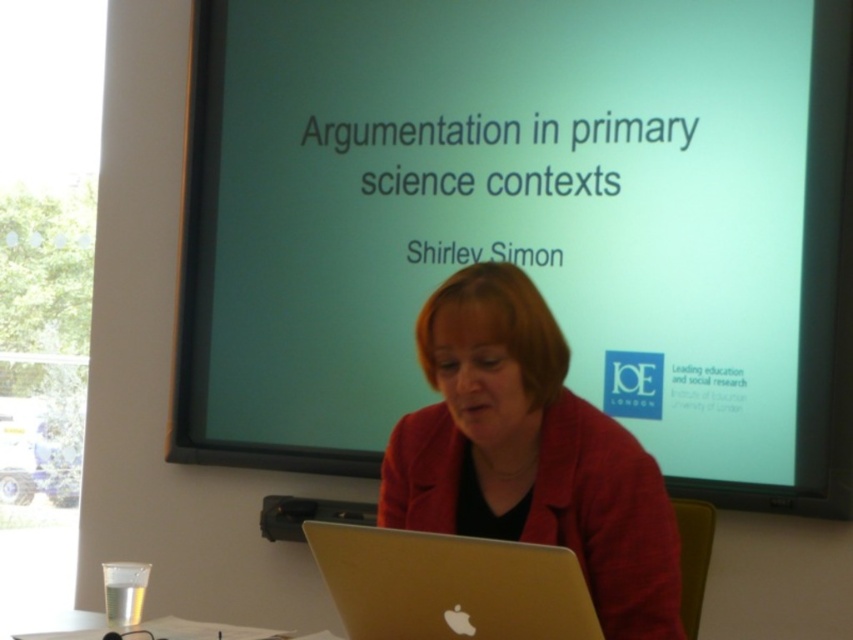
Question: In this image, where is green matte projection screen at upper center located relative to matte gold laptop at center?

Choices:
 (A) above
 (B) below

Answer: (A)

Question: Which point is closer to the camera taking this photo?

Choices:
 (A) (279, 502)
 (B) (222, 298)
 (C) (593, 573)
 (D) (486, 621)

Answer: (D)

Question: Does matte gold laptop at center appear under black plastic projector at center?

Choices:
 (A) no
 (B) yes

Answer: (A)

Question: Among these objects, which one is farthest from the camera?

Choices:
 (A) green matte projection screen at upper center
 (B) silver metallic laptop at center
 (C) black plastic projector at center

Answer: (C)

Question: Which point is farther to the camera?

Choices:
 (A) (717, 182)
 (B) (305, 506)
 (C) (360, 632)

Answer: (B)

Question: Can you confirm if matte gold laptop at center is thinner than silver metallic laptop at center?

Choices:
 (A) no
 (B) yes

Answer: (A)